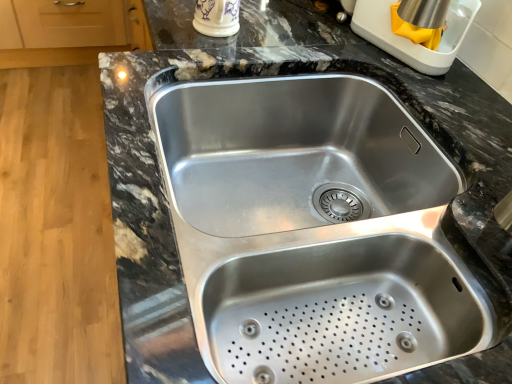
Question: Is stainless steel kettle at upper right, which ranks as the first appliance in right-to-left order, not inside porcelain cup at upper center, the first appliance positioned from the left?

Choices:
 (A) yes
 (B) no

Answer: (A)

Question: Is stainless steel kettle at upper right, which ranks as the first appliance in right-to-left order, with porcelain cup at upper center, the first appliance positioned from the left?

Choices:
 (A) yes
 (B) no

Answer: (B)

Question: Does stainless steel kettle at upper right, which ranks as the first appliance in right-to-left order, have a greater height compared to porcelain cup at upper center, the first appliance positioned from the left?

Choices:
 (A) no
 (B) yes

Answer: (B)

Question: Is stainless steel kettle at upper right, the second appliance when ordered from left to right, facing towards porcelain cup at upper center, the 2th appliance viewed from the right?

Choices:
 (A) no
 (B) yes

Answer: (B)

Question: Does stainless steel kettle at upper right, the second appliance when ordered from left to right, have a lesser height compared to porcelain cup at upper center, the 2th appliance viewed from the right?

Choices:
 (A) no
 (B) yes

Answer: (A)

Question: Is the depth of stainless steel kettle at upper right, which ranks as the first appliance in right-to-left order, less than that of porcelain cup at upper center, the first appliance positioned from the left?

Choices:
 (A) no
 (B) yes

Answer: (B)

Question: From the image's perspective, is stainless steel sink at center above stainless steel kettle at upper right, the second appliance when ordered from left to right?

Choices:
 (A) yes
 (B) no

Answer: (B)

Question: Considering the relative sizes of stainless steel sink at center and stainless steel kettle at upper right, the second appliance when ordered from left to right, in the image provided, is stainless steel sink at center thinner than stainless steel kettle at upper right, the second appliance when ordered from left to right,?

Choices:
 (A) no
 (B) yes

Answer: (A)

Question: Does stainless steel sink at center turn towards stainless steel kettle at upper right, the second appliance when ordered from left to right?

Choices:
 (A) yes
 (B) no

Answer: (B)

Question: Is stainless steel sink at center further to the viewer compared to stainless steel kettle at upper right, the second appliance when ordered from left to right?

Choices:
 (A) no
 (B) yes

Answer: (A)

Question: Considering the relative sizes of stainless steel sink at center and stainless steel kettle at upper right, which ranks as the first appliance in right-to-left order, in the image provided, is stainless steel sink at center wider than stainless steel kettle at upper right, which ranks as the first appliance in right-to-left order,?

Choices:
 (A) no
 (B) yes

Answer: (B)

Question: From a real-world perspective, is stainless steel sink at center below stainless steel kettle at upper right, the second appliance when ordered from left to right?

Choices:
 (A) no
 (B) yes

Answer: (B)

Question: Does stainless steel sink at center have a larger size compared to porcelain cup at upper center, the 2th appliance viewed from the right?

Choices:
 (A) no
 (B) yes

Answer: (B)